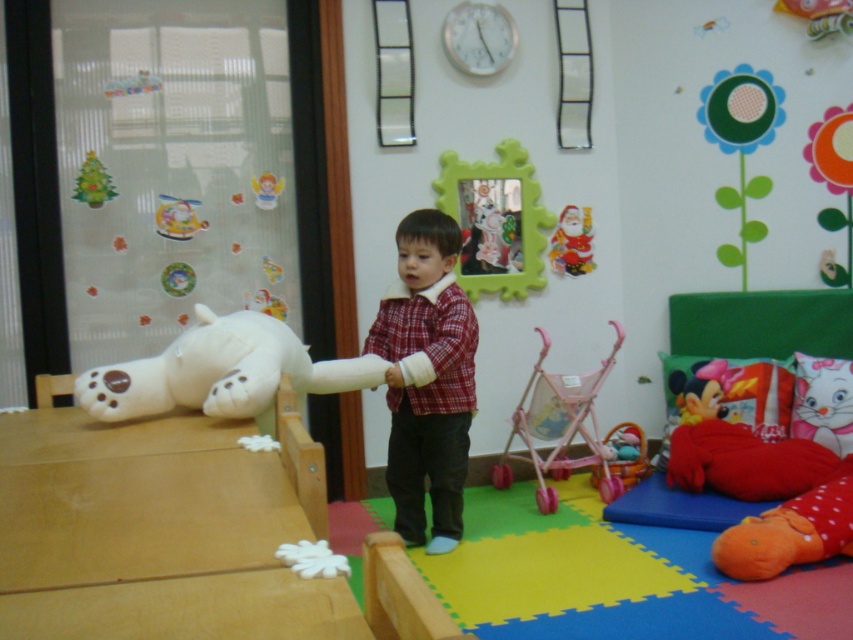
Is white plush bear at left smaller than green matte christmas tree at upper left?

Incorrect, white plush bear at left is not smaller in size than green matte christmas tree at upper left.

From the picture: Is white plush bear at left thinner than green matte christmas tree at upper left?

No.

Which is in front, point (178, 381) or point (85, 168)?

Point (178, 381) is in front.

This screenshot has width=853, height=640. In order to click on white plush bear at left in this screenshot , I will do `click(221, 372)`.

Can you confirm if red plaid shirt at center is taller than pink plastic stroller at lower right?

Yes, red plaid shirt at center is taller than pink plastic stroller at lower right.

You are a GUI agent. You are given a task and a screenshot of the screen. Output one action in this format:
    pyautogui.click(x=<x>, y=<y>)
    Task: Click on the red plaid shirt at center
    The width and height of the screenshot is (853, 640).
    Given the screenshot: What is the action you would take?
    pyautogui.click(x=427, y=380)

Can you confirm if pink plastic stroller at lower right is thinner than green matte christmas tree at upper left?

No.

Does pink plastic stroller at lower right have a larger size compared to green matte christmas tree at upper left?

Yes, pink plastic stroller at lower right is bigger than green matte christmas tree at upper left.

This screenshot has height=640, width=853. What do you see at coordinates (560, 426) in the screenshot?
I see `pink plastic stroller at lower right` at bounding box center [560, 426].

I want to click on pink plastic stroller at lower right, so click(560, 426).